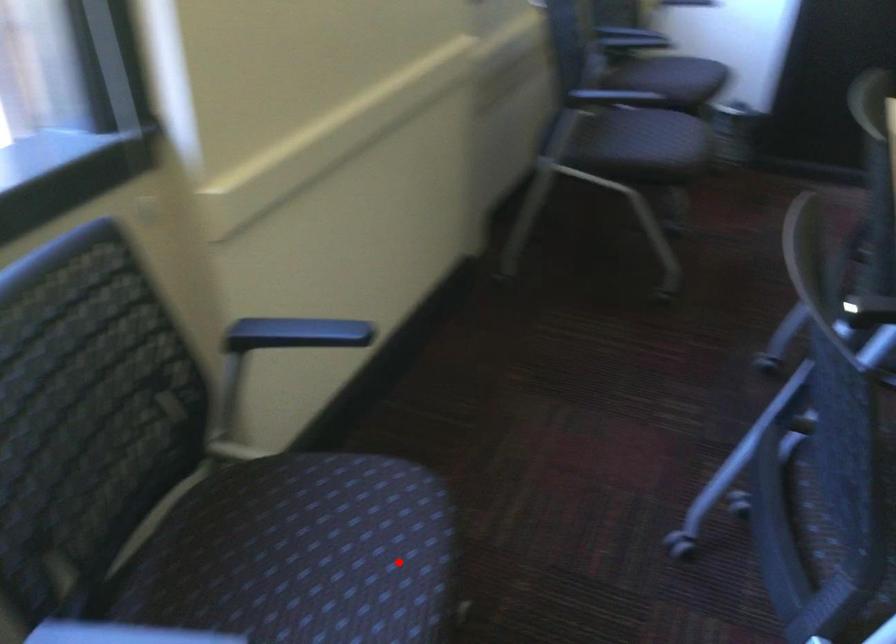
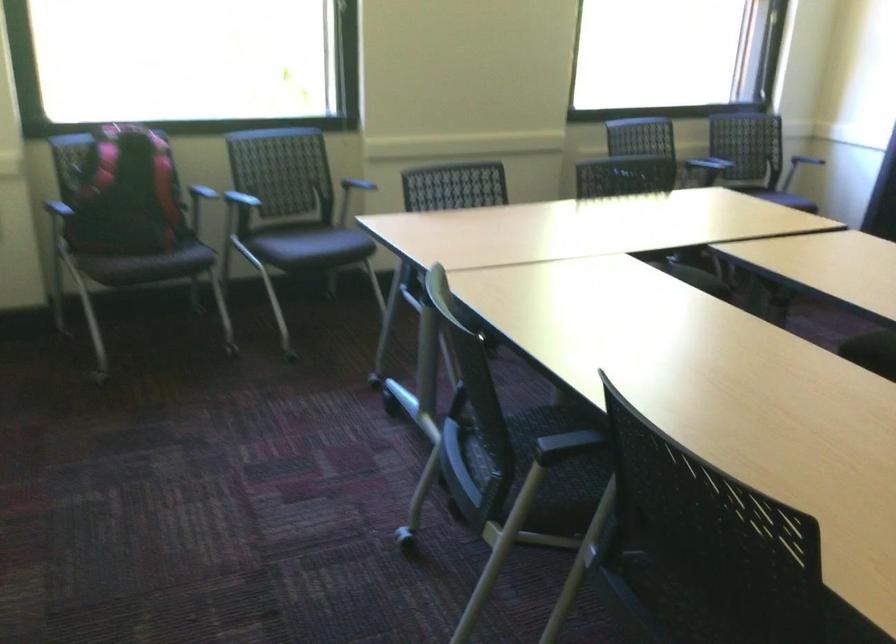
Question: I am providing you with two images of the same scene from different viewpoints. In image1, a red point is highlighted. Considering the same 3D point in image2, which of the following is correct?

Choices:
 (A) It is closer
 (B) It is farther

Answer: (B)